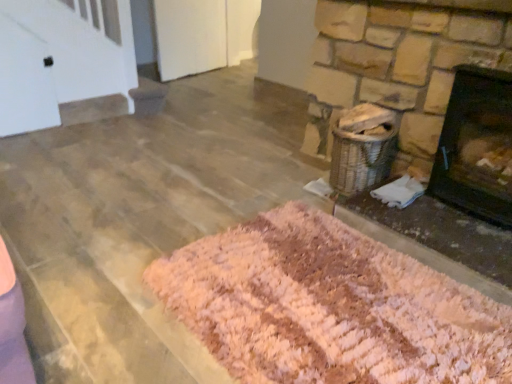
Where is `pink shaggy rug at lower center`? This screenshot has width=512, height=384. pink shaggy rug at lower center is located at coordinates (330, 307).

Choose the correct answer: Is black matte fireplace at right inside pink shaggy rug at lower center or outside it?

black matte fireplace at right is located beyond the bounds of pink shaggy rug at lower center.

From a real-world perspective, who is located higher, black matte fireplace at right or pink shaggy rug at lower center?

In real-world perspective, black matte fireplace at right is above.

Does point (490, 91) lie in front of point (424, 343)?

That is False.

Between black matte fireplace at right and pink shaggy rug at lower center, which one appears on the left side from the viewer's perspective?

pink shaggy rug at lower center is more to the left.

The image size is (512, 384). In order to click on foundation located underneath the black matte fireplace at right (from a real-world perspective) in this screenshot , I will do `click(438, 240)`.

From the image's perspective, between black matte fireplace at right and pink shag rug at lower right, who is located below?

pink shag rug at lower right is shown below in the image.

From a real-world perspective, which object rests below the other?

pink shag rug at lower right.

Does black matte fireplace at right appear on the right side of pink shag rug at lower right?

Yes.

Can you tell me how much pink shaggy rug at lower center and black matte fireplace at right differ in facing direction?

The angular difference between pink shaggy rug at lower center and black matte fireplace at right is 2.32 degrees.

From a real-world perspective, which is physically above, pink shaggy rug at lower center or black matte fireplace at right?

From a 3D spatial view, black matte fireplace at right is above.

In the image, is pink shaggy rug at lower center positioned in front of or behind black matte fireplace at right?

In the image, pink shaggy rug at lower center appears in front of black matte fireplace at right.

Is pink shaggy rug at lower center thinner than black matte fireplace at right?

No.

From the image's perspective, is pink shaggy rug at lower center above pink shag rug at lower right?

Actually, pink shaggy rug at lower center appears below pink shag rug at lower right in the image.

Is pink shaggy rug at lower center oriented away from pink shag rug at lower right?

Yes, pink shaggy rug at lower center is positioned with its back facing pink shag rug at lower right.

In terms of width, does pink shaggy rug at lower center look wider or thinner when compared to pink shag rug at lower right?

Considering their sizes, pink shaggy rug at lower center looks broader than pink shag rug at lower right.

Considering their positions, is pink shaggy rug at lower center located in front of or behind pink shag rug at lower right?

Clearly, pink shaggy rug at lower center is in front of pink shag rug at lower right.

In terms of size, does pink shag rug at lower right appear bigger or smaller than black matte fireplace at right?

In the image, pink shag rug at lower right appears to be smaller than black matte fireplace at right.

From the image's perspective, between pink shag rug at lower right and black matte fireplace at right, who is located below?

From the image's view, pink shag rug at lower right is below.

Is pink shag rug at lower right surrounding black matte fireplace at right?

No, black matte fireplace at right is not a part of pink shag rug at lower right.

This screenshot has width=512, height=384. Find the location of `fireplace positioned vertically above the pink shag rug at lower right (from a real-world perspective)`. fireplace positioned vertically above the pink shag rug at lower right (from a real-world perspective) is located at coordinates [477, 145].

Between pink shag rug at lower right and pink shaggy rug at lower center, which one has more height?

With more height is pink shag rug at lower right.

Between pink shag rug at lower right and pink shaggy rug at lower center, which one has larger size?

Bigger between the two is pink shaggy rug at lower center.

In the scene shown: Is pink shag rug at lower right in front of or behind pink shaggy rug at lower center in the image?

Clearly, pink shag rug at lower right is behind pink shaggy rug at lower center.

Is pink shag rug at lower right directly adjacent to pink shaggy rug at lower center?

No, pink shag rug at lower right is not beside pink shaggy rug at lower center.

At what (x,y) coordinates should I click in order to perform the action: click on mat located underneath the black matte fireplace at right (from a real-world perspective). Please return your answer as a coordinate pair (x, y). This screenshot has height=384, width=512. Looking at the image, I should click on (330, 307).

Where is `foundation on the left side of black matte fireplace at right`? foundation on the left side of black matte fireplace at right is located at coordinates (438, 240).

Considering their positions, is black matte fireplace at right positioned further to pink shaggy rug at lower center than pink shag rug at lower right?

black matte fireplace at right.

Looking at the image, which one is located closer to black matte fireplace at right, pink shaggy rug at lower center or pink shag rug at lower right?

pink shag rug at lower right.

Estimate the real-world distances between objects in this image. Which object is closer to pink shaggy rug at lower center, pink shag rug at lower right or black matte fireplace at right?

pink shag rug at lower right is closer to pink shaggy rug at lower center.

In the scene shown: Which object lies further to the anchor point black matte fireplace at right, pink shag rug at lower right or pink shaggy rug at lower center?

Based on the image, pink shaggy rug at lower center appears to be further to black matte fireplace at right.

Consider the image. Based on their spatial positions, is black matte fireplace at right or pink shaggy rug at lower center further from pink shag rug at lower right?

pink shaggy rug at lower center is further to pink shag rug at lower right.

Considering their positions, is pink shaggy rug at lower center positioned closer to pink shag rug at lower right than black matte fireplace at right?

black matte fireplace at right.

The width and height of the screenshot is (512, 384). What are the coordinates of `foundation located between pink shaggy rug at lower center and black matte fireplace at right in the left-right direction` in the screenshot? It's located at (438, 240).